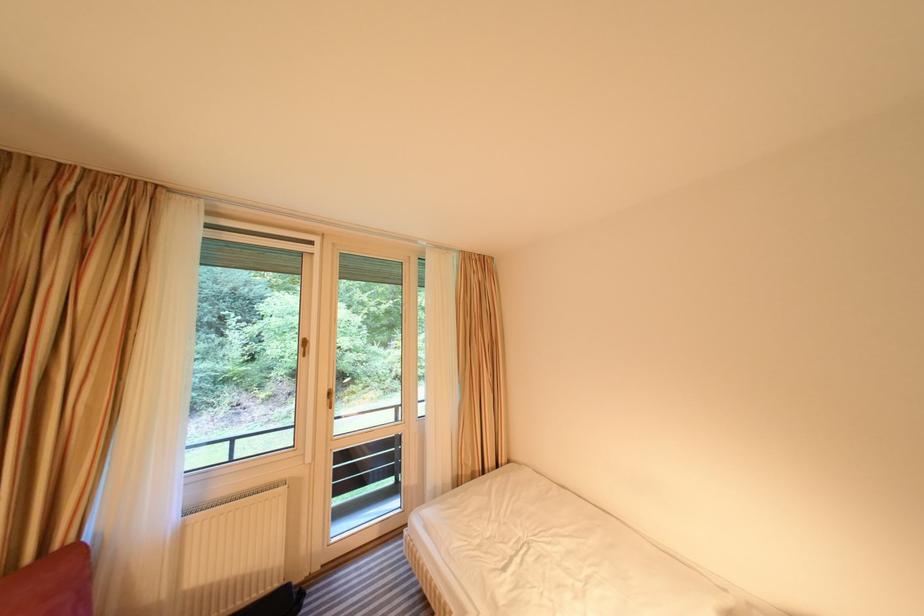
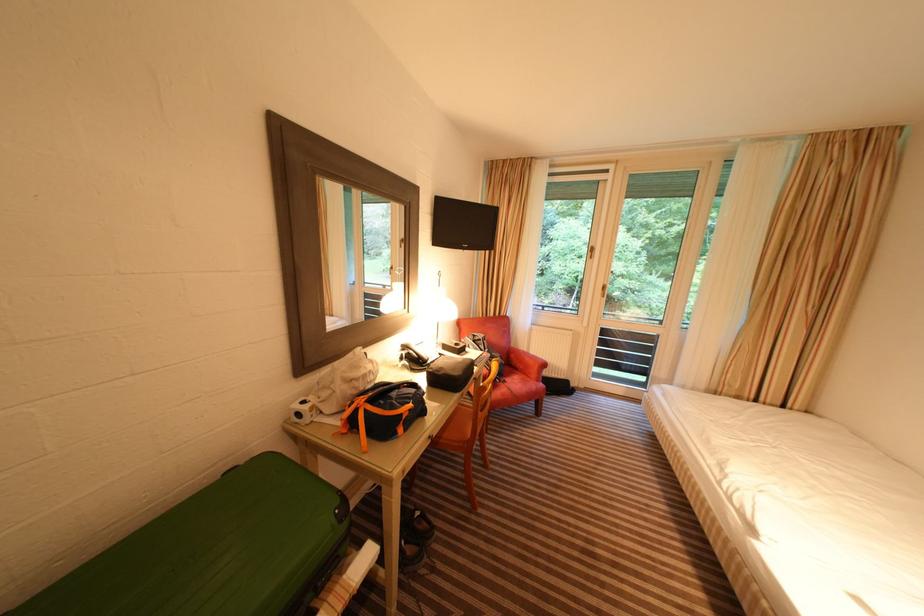
First-person continuous shooting, in which direction is the camera rotating?

The camera rotated toward left-down.